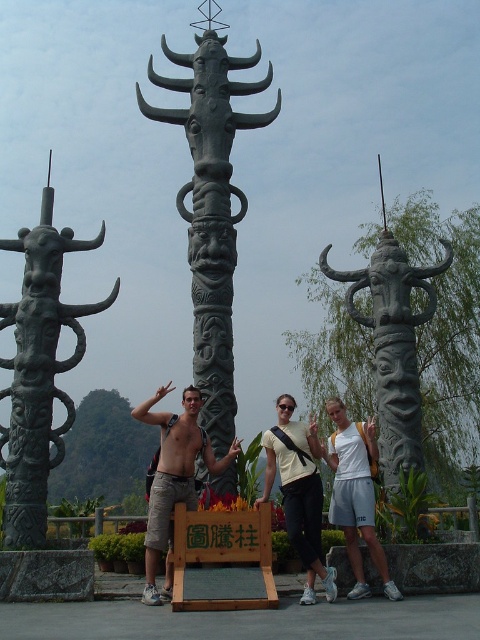
Question: Which of the following is the farthest from the observer?

Choices:
 (A) (206, 45)
 (B) (50, 369)
 (C) (398, 392)
 (D) (300, 534)

Answer: (A)

Question: Is black stone totem pole at center wider than white matte shirt at center?

Choices:
 (A) no
 (B) yes

Answer: (B)

Question: Is white matte shirt at center bigger than matte black shorts at center?

Choices:
 (A) no
 (B) yes

Answer: (B)

Question: Where is dark gray stone totem at center located in relation to shiny silver statue at center in the image?

Choices:
 (A) right
 (B) left

Answer: (A)

Question: Which of the following is the farthest from the observer?

Choices:
 (A) (139, 417)
 (B) (22, 301)

Answer: (B)

Question: Which point is closer to the camera?

Choices:
 (A) black stone totem at center
 (B) matte black shorts at center
 (C) white matte shirt at center

Answer: (C)